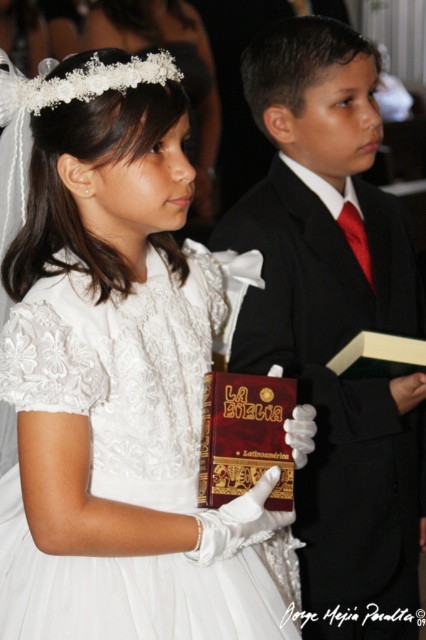
You are a photographer at the event and want to ensure both the white lace dress at center and the shiny black suit at center are fully visible in the photo. Based on their heights, which one might need to be positioned closer to the camera to avoid being obscured?

The white lace dress at center is not as tall as the shiny black suit at center, so positioning the white lace dress at center closer to the camera would help ensure both are fully visible without obstruction.

Based on the photo, you are a photographer at the event and want to take a closeup shot of the dark red leather bible at center. However, the white lace dress at center is blocking your view. Can you adjust your position to capture the bible without the dress in the frame?

The white lace dress at center is closer to the viewer than the dark red leather bible at center, so moving your camera position slightly to the side or lowering the angle might allow you to capture the dark red leather bible at center while avoiding the obstruction from the white lace dress at center.

You are a photographer at the event and need to capture a clear shot of both the white lace dress at center and the dark red leather bible at center. Based on their positions, which object should you focus on first to ensure both are in frame?

The white lace dress at center is located above the dark red leather bible at center, so focusing on the dress first will allow the photographer to adjust the frame to include both objects.